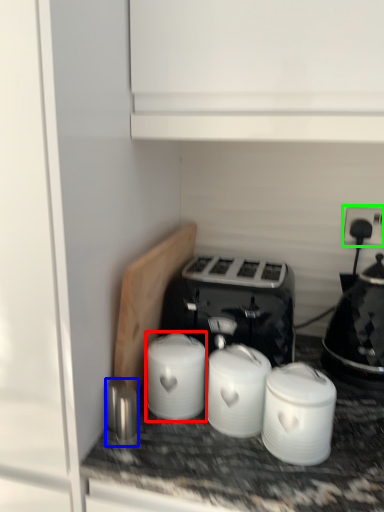
Question: Which object is the closest to the appliance (highlighted by a red box)? Choose among these: appliance (highlighted by a blue box) or electric outlet (highlighted by a green box).

Choices:
 (A) appliance
 (B) electric outlet

Answer: (A)